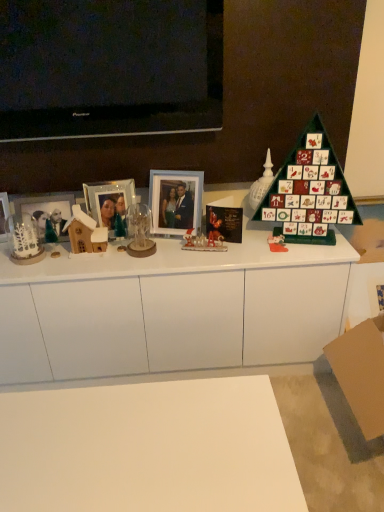
The image size is (384, 512). I want to click on free space in front of green wooden advent calendar at right, which is counted as the 2th toy, starting from the right, so click(x=268, y=244).